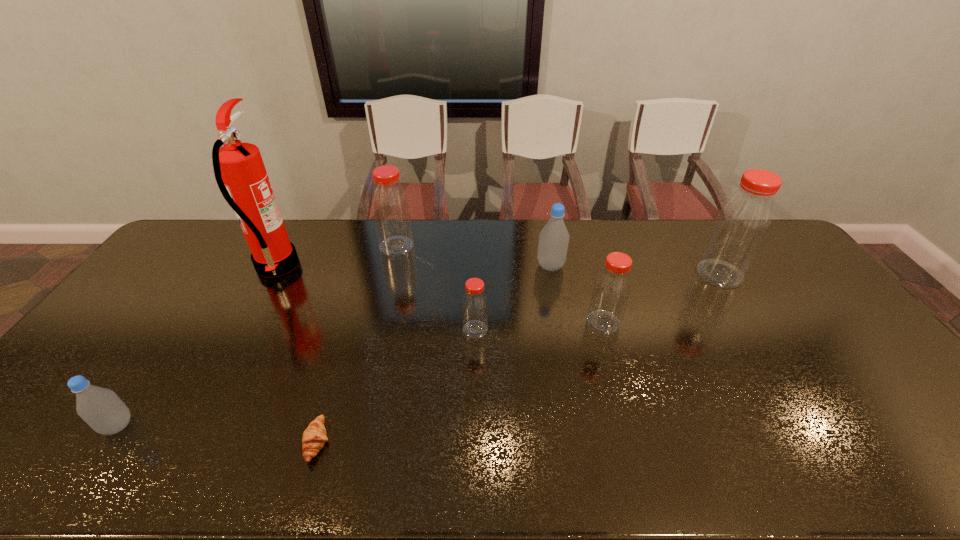
Find the location of a particular element. The height and width of the screenshot is (540, 960). vacant region between the fifth bottle from left to right and the third bottle from right to left is located at coordinates (577, 294).

The width and height of the screenshot is (960, 540). I want to click on unoccupied area between the pastry and the third red bottle from right to left, so click(396, 386).

This screenshot has width=960, height=540. Identify the location of free space between the tallest object and the third smallest red bottle. (337, 256).

The image size is (960, 540). Identify the location of vacant area that lies between the fifth object from left to right and the pastry. (396, 386).

Locate an element on the screen. The image size is (960, 540). blank region between the right gray bottle and the third bottle from left to right is located at coordinates (513, 298).

Find the location of a particular element. This screenshot has height=540, width=960. free spot between the farther gray bottle and the red fire extinguisher is located at coordinates click(414, 266).

The height and width of the screenshot is (540, 960). Find the location of `empty location between the farthest red bottle and the fire extinguisher`. empty location between the farthest red bottle and the fire extinguisher is located at coordinates (337, 256).

The image size is (960, 540). In order to click on vacant space in between the rightmost red bottle and the second bottle from right to left in this screenshot , I will do `click(661, 298)`.

You are a GUI agent. You are given a task and a screenshot of the screen. Output one action in this format:
    pyautogui.click(x=<x>, y=<y>)
    Task: Click on the free space that is in between the third object from right to left and the fifth object from left to right
    The width and height of the screenshot is (960, 540).
    Given the screenshot: What is the action you would take?
    pyautogui.click(x=513, y=298)

Where is `the sixth closest object to the leftmost object`? This screenshot has width=960, height=540. the sixth closest object to the leftmost object is located at coordinates (612, 287).